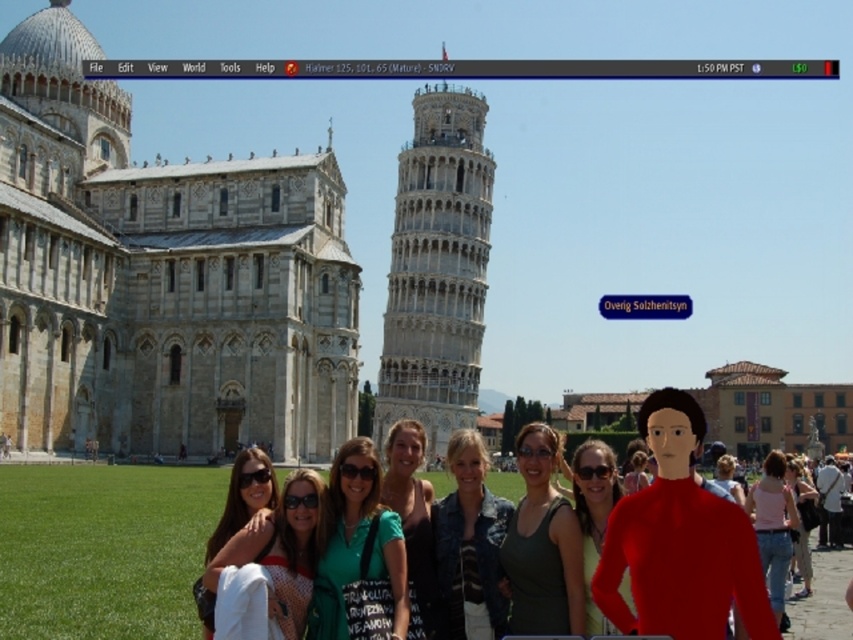
You are a photographer trying to capture the entire scene of the light gray stone cathedral at left and the denim jeans at lower right in one shot. Based on their positions, which object should you focus on first to ensure both are in frame?

The light gray stone cathedral at left is located above denim jeans at lower right, so to capture both in one shot, focus on the light gray stone cathedral at left first as it is higher up, ensuring the denim jeans at lower right will be included in the lower part of the frame.